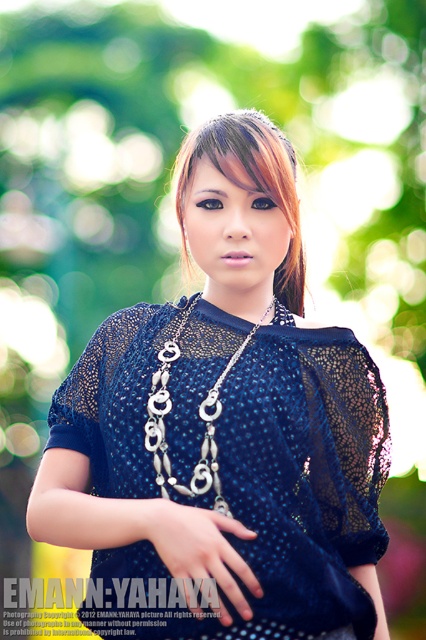
The height and width of the screenshot is (640, 426). Describe the element at coordinates (224, 432) in the screenshot. I see `matte blue blouse at center` at that location.

Is matte blue blouse at center shorter than silver metallic chain at center?

No, matte blue blouse at center is not shorter than silver metallic chain at center.

You are a GUI agent. You are given a task and a screenshot of the screen. Output one action in this format:
    pyautogui.click(x=<x>, y=<y>)
    Task: Click on the matte blue blouse at center
    The image size is (426, 640).
    Given the screenshot: What is the action you would take?
    pyautogui.click(x=224, y=432)

Does brown shiny hair at center have a greater height compared to silver metallic chain at center?

Yes, brown shiny hair at center is taller than silver metallic chain at center.

Describe the element at coordinates (250, 182) in the screenshot. The width and height of the screenshot is (426, 640). I see `brown shiny hair at center` at that location.

Locate an element on the screen. The height and width of the screenshot is (640, 426). brown shiny hair at center is located at coordinates (250, 182).

Is the position of matte blue blouse at center more distant than that of brown shiny hair at center?

No.

Who is positioned more to the right, matte blue blouse at center or brown shiny hair at center?

Positioned to the right is brown shiny hair at center.

The width and height of the screenshot is (426, 640). Identify the location of matte blue blouse at center. (224, 432).

This screenshot has width=426, height=640. In order to click on matte blue blouse at center in this screenshot , I will do `click(224, 432)`.